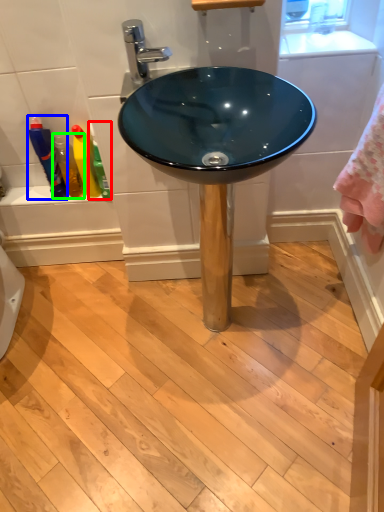
Question: Based on their relative distances, which object is nearer to cleaning product (highlighted by a red box)? Choose from bottle (highlighted by a blue box) and toiletry (highlighted by a green box).

Choices:
 (A) bottle
 (B) toiletry

Answer: (B)